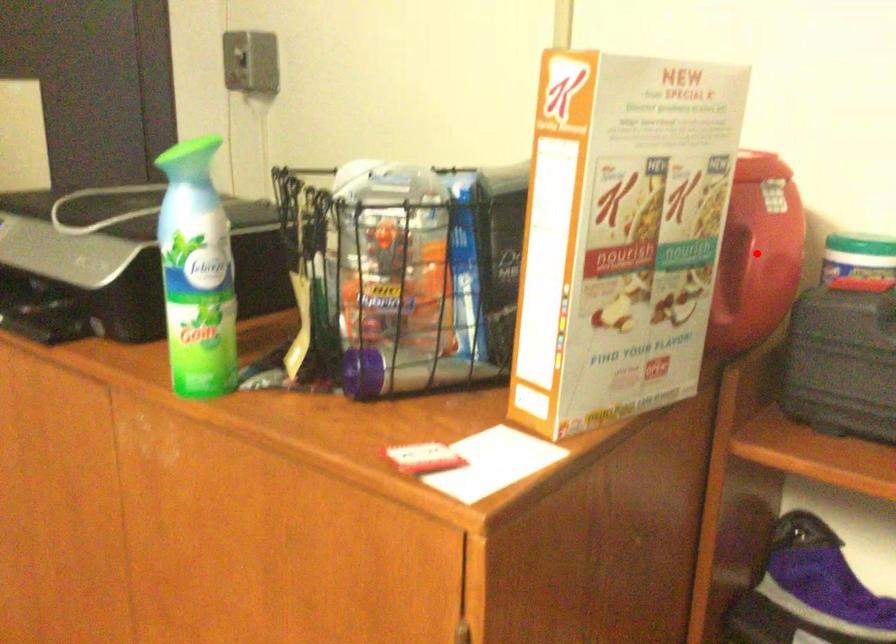
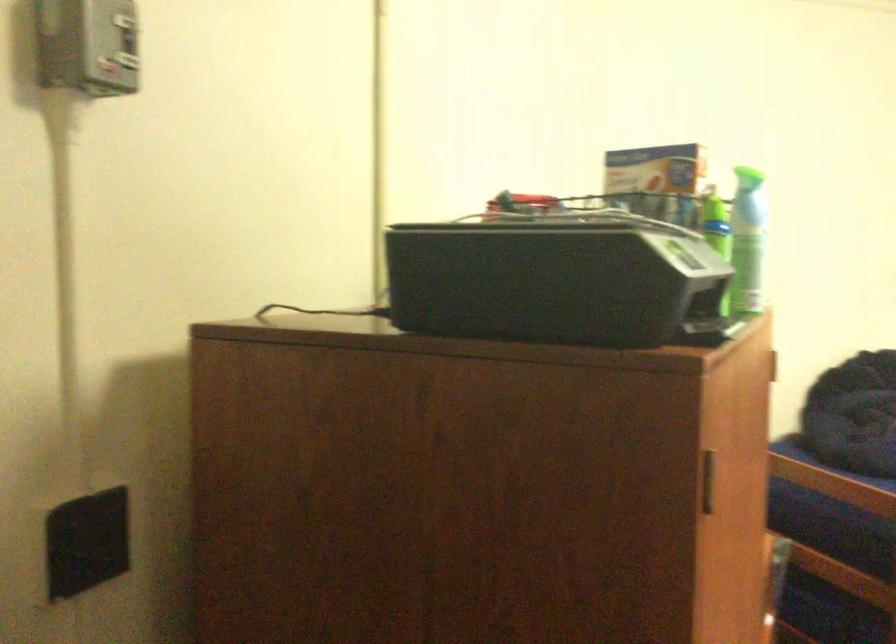
Question: I am providing you with two images of the same scene from different viewpoints. A red point is marked on the first image. Is the red point's position out of view in image 2?

Choices:
 (A) Yes
 (B) No

Answer: (A)